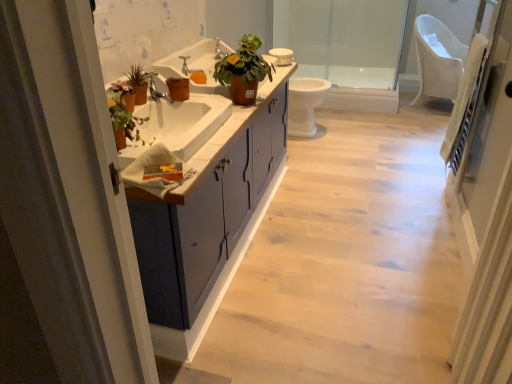
Question: Does white textured screen door at right lie in front of matte white cabinet at center?

Choices:
 (A) yes
 (B) no

Answer: (A)

Question: Is matte white cabinet at center a part of white textured screen door at right?

Choices:
 (A) yes
 (B) no

Answer: (B)

Question: Considering the relative sizes of white textured screen door at right and matte white cabinet at center in the image provided, is white textured screen door at right shorter than matte white cabinet at center?

Choices:
 (A) yes
 (B) no

Answer: (B)

Question: Is the depth of white textured screen door at right greater than that of matte white cabinet at center?

Choices:
 (A) yes
 (B) no

Answer: (B)

Question: From the image's perspective, is white textured screen door at right beneath matte white cabinet at center?

Choices:
 (A) yes
 (B) no

Answer: (A)

Question: Could you tell me if white textured screen door at right is turned towards matte white cabinet at center?

Choices:
 (A) yes
 (B) no

Answer: (A)

Question: Is transparent glass shower door at upper center outside polished chrome faucet at center, arranged as the 1th faucet when ordered from the bottom?

Choices:
 (A) no
 (B) yes

Answer: (B)

Question: Considering the relative sizes of transparent glass shower door at upper center and polished chrome faucet at center, placed as the 2th faucet when sorted from right to left, in the image provided, is transparent glass shower door at upper center taller than polished chrome faucet at center, placed as the 2th faucet when sorted from right to left,?

Choices:
 (A) yes
 (B) no

Answer: (A)

Question: Is transparent glass shower door at upper center positioned with its back to polished chrome faucet at center, arranged as the 1th faucet when ordered from the bottom?

Choices:
 (A) yes
 (B) no

Answer: (B)

Question: Considering the relative sizes of transparent glass shower door at upper center and polished chrome faucet at center, the first faucet viewed from the left, in the image provided, is transparent glass shower door at upper center smaller than polished chrome faucet at center, the first faucet viewed from the left,?

Choices:
 (A) yes
 (B) no

Answer: (B)

Question: Is polished chrome faucet at center, the 1th faucet from the front, located within transparent glass shower door at upper center?

Choices:
 (A) no
 (B) yes

Answer: (A)

Question: Does transparent glass shower door at upper center have a lesser height compared to polished chrome faucet at center, the 1th faucet from the front?

Choices:
 (A) no
 (B) yes

Answer: (A)

Question: Does matte white cabinet at center have a larger size compared to white glossy toilet at center?

Choices:
 (A) no
 (B) yes

Answer: (B)